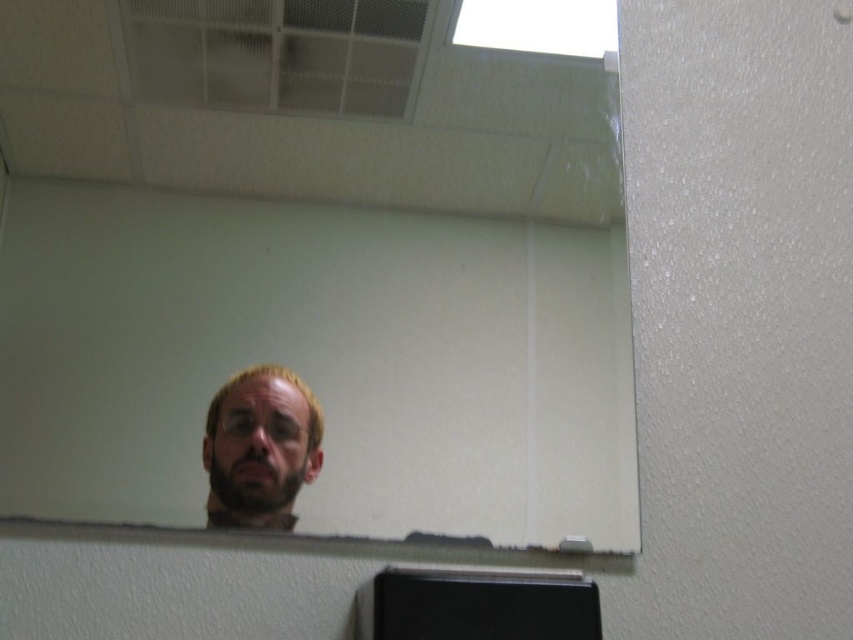
Question: Which point is closer to the camera?

Choices:
 (A) (265, 403)
 (B) (125, 68)

Answer: (A)

Question: Among these points, which one is nearest to the camera?

Choices:
 (A) (297, 492)
 (B) (268, 152)

Answer: (A)

Question: Is clear glass mirror at center to the left of light brown hair at center from the viewer's perspective?

Choices:
 (A) no
 (B) yes

Answer: (A)

Question: Is the position of clear glass mirror at center more distant than that of light brown hair at center?

Choices:
 (A) yes
 (B) no

Answer: (B)

Question: Can you confirm if clear glass mirror at center is smaller than light brown hair at center?

Choices:
 (A) yes
 (B) no

Answer: (B)